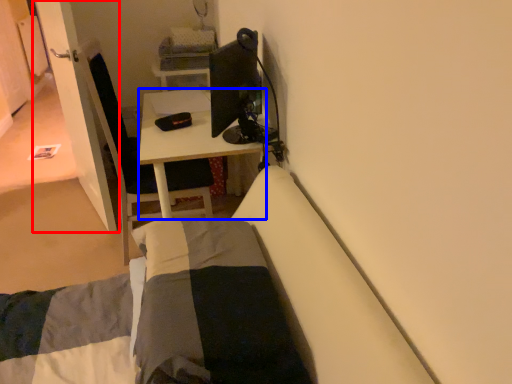
Question: Among these objects, which one is farthest to the camera, door (highlighted by a red box) or desk (highlighted by a blue box)?

Choices:
 (A) door
 (B) desk

Answer: (A)